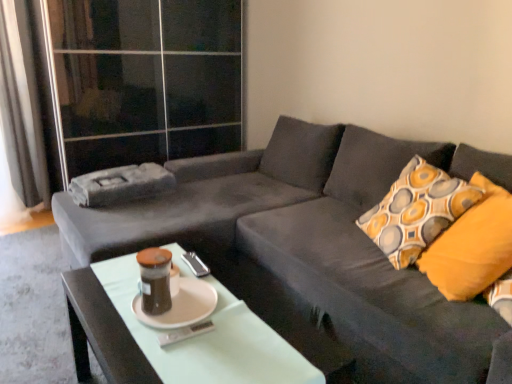
The image size is (512, 384). What are the coordinates of `vacant space situated on the left part of white matte saucer at center` in the screenshot? It's located at (109, 295).